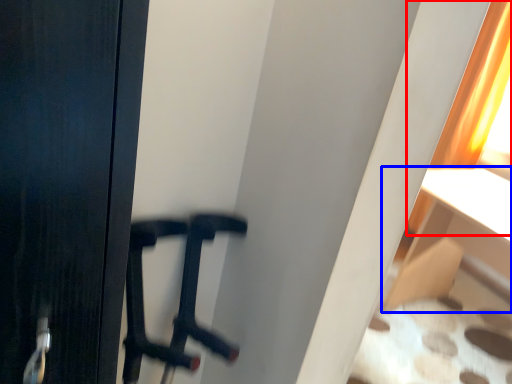
Question: Which point is further to the camera, curtain (highlighted by a red box) or furniture (highlighted by a blue box)?

Choices:
 (A) curtain
 (B) furniture

Answer: (A)